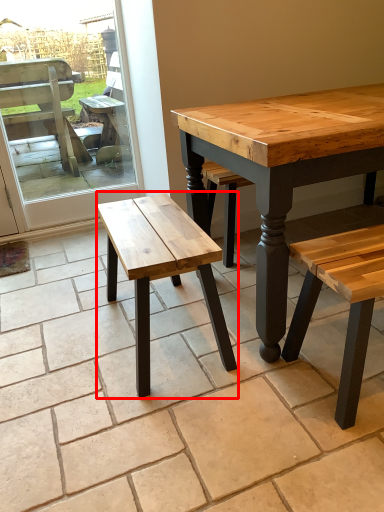
Question: In this image, where is stool (annotated by the red box) located relative to screen door?

Choices:
 (A) left
 (B) right

Answer: (B)